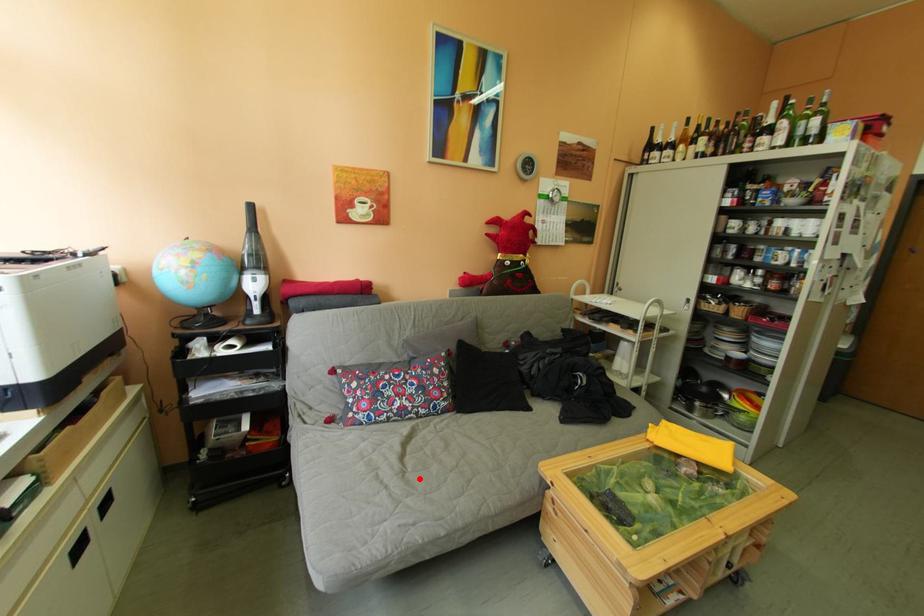
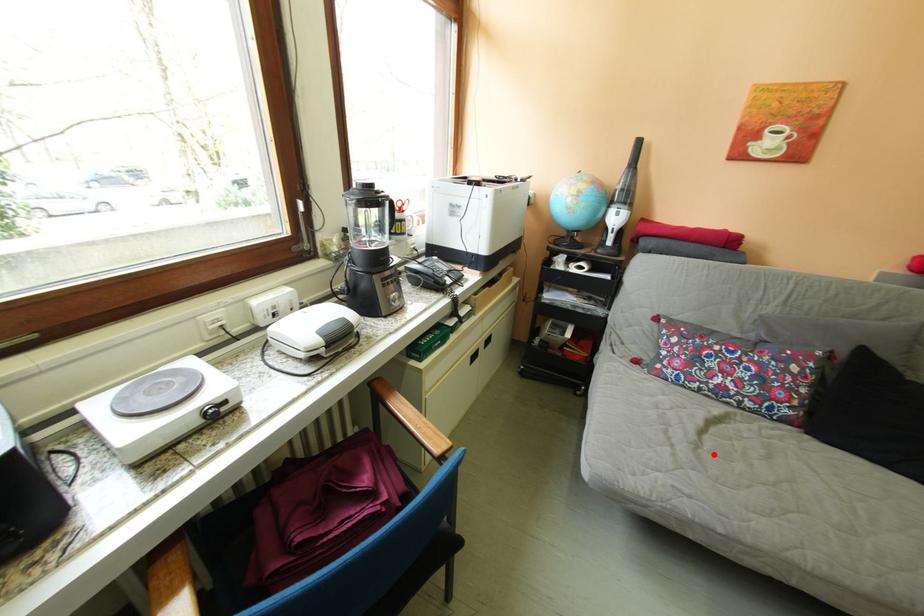
I am providing you with two images of the same scene from different viewpoints. A red point is marked on the first image and another point is marked on the second image. Is the marked point in image1 the same physical position as the marked point in image2?

Yes